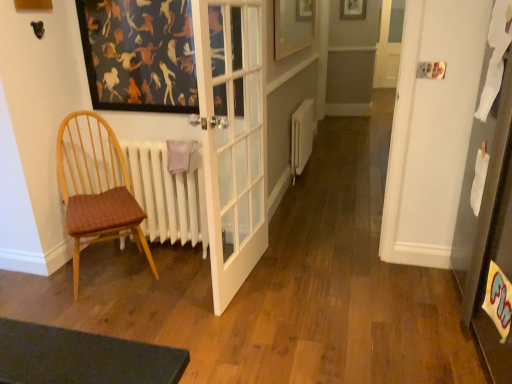
This screenshot has height=384, width=512. In order to click on vacant space underneath white matte radiator at left (from a real-world perspective) in this screenshot , I will do `click(174, 254)`.